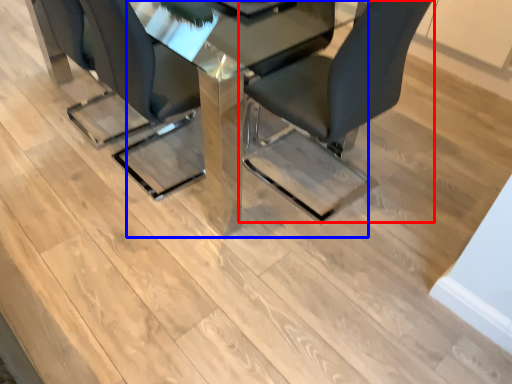
Question: Among these objects, which one is nearest to the camera, chair (highlighted by a red box) or table (highlighted by a blue box)?

Choices:
 (A) chair
 (B) table

Answer: (A)